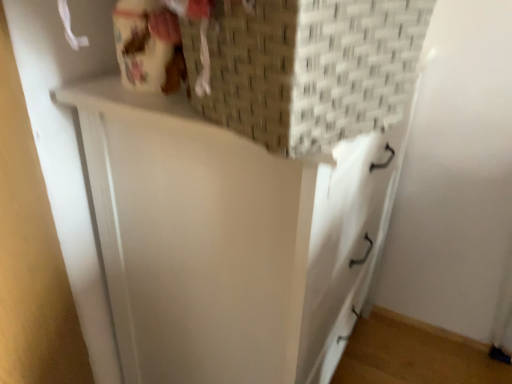
This screenshot has width=512, height=384. What do you see at coordinates (308, 68) in the screenshot?
I see `woven cardboard box at upper center` at bounding box center [308, 68].

Locate an element on the screen. This screenshot has width=512, height=384. woven cardboard box at upper center is located at coordinates (308, 68).

Where is `woven cardboard box at upper center`? woven cardboard box at upper center is located at coordinates (308, 68).